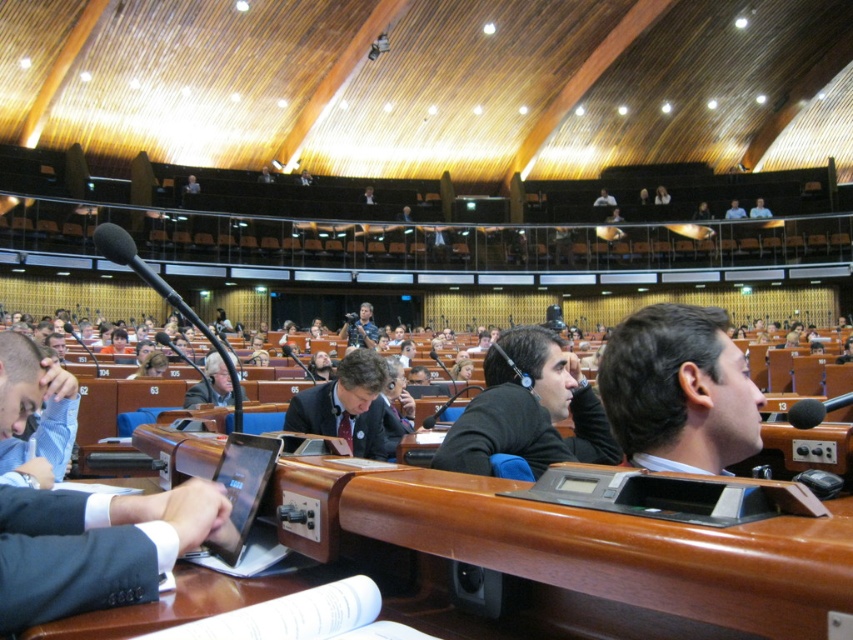
You are setting up a live stream for the meeting and need to position a new camera so that it aligns with the existing matte black camera at center. What are the coordinates where you should place the new camera?

The matte black camera at center is located at point (x=360, y=326), so you should place the new camera at the same coordinates to align with it.

You are a photographer positioned at the back of the auditorium. You want to take a photo of the black matte suit at center and the light blue shirt at upper right so that both are clearly visible in the frame. Given that your camera has a maximum focus range of 100 feet, will you be able to capture both subjects in focus?

The black matte suit at center is 104.56 feet from the light blue shirt at upper right. Since the distance between them exceeds the camera focus range of 100 feet, capturing both in focus may be challenging. However, the photographer is at the back, so the actual distance from the camera to each subject might be within range. Without knowing the exact distance from the photographer to each subject, it is impossible to determine if both can be in focus.

You are setting up equipment for a live stream and need to place the matte black camera at center and the light blue shirt at upper right on a shelf. The shelf has a width of 1 meter. Can both items fit side by side?

The matte black camera at center is wider than the light blue shirt at upper right. However, since the shelf is 1 meter wide, both items can fit side by side as long as their combined widths do not exceed 1 meter. Unfortunately, without knowing the exact widths, we cannot confirm if they will fit.